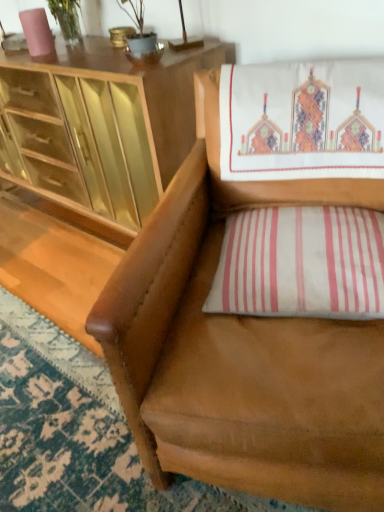
Where is `blank space above white striped pillow at lower right (from a real-world perspective)`? blank space above white striped pillow at lower right (from a real-world perspective) is located at coordinates (323, 220).